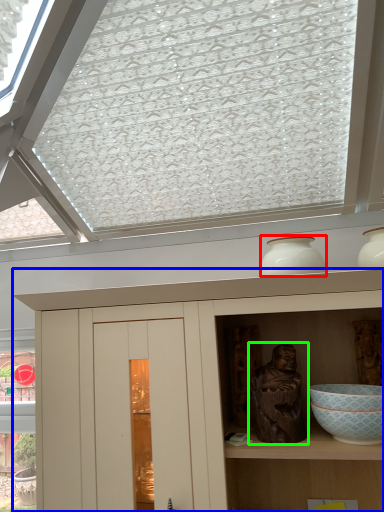
Question: Which is nearer to the vase (highlighted by a red box)? cupboard (highlighted by a blue box) or sculpture (highlighted by a green box).

Choices:
 (A) cupboard
 (B) sculpture

Answer: (B)